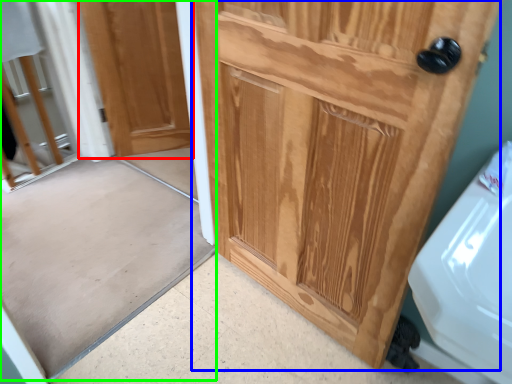
Question: Which object is positioned closest to door (highlighted by a red box)? Select from door (highlighted by a blue box) and screen door (highlighted by a green box).

Choices:
 (A) door
 (B) screen door

Answer: (B)